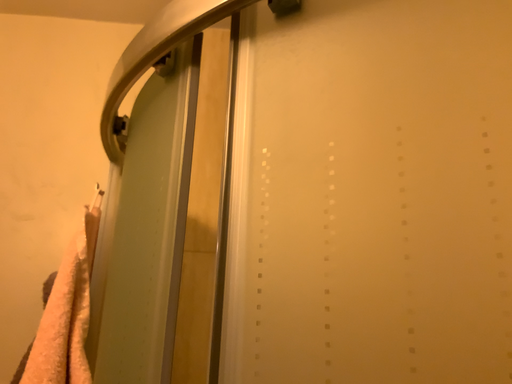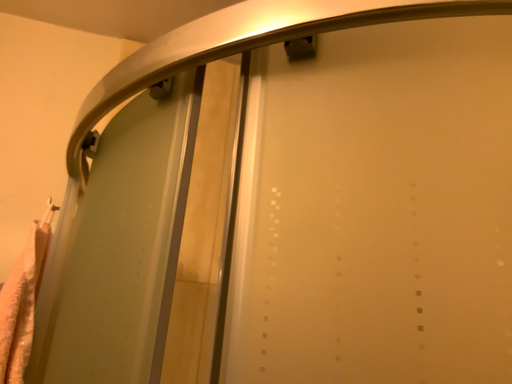
Question: Which way did the camera rotate in the video?

Choices:
 (A) rotated left
 (B) rotated right

Answer: (B)